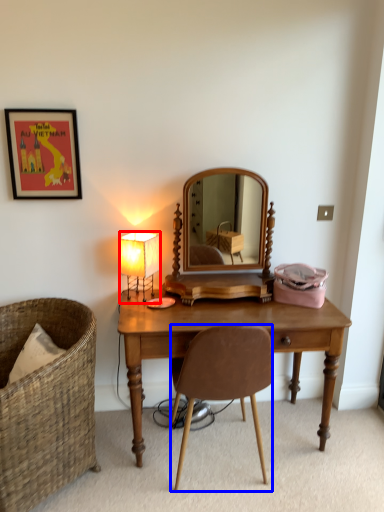
Question: Which object appears farthest to the camera in this image, lamp (highlighted by a red box) or chair (highlighted by a blue box)?

Choices:
 (A) lamp
 (B) chair

Answer: (A)